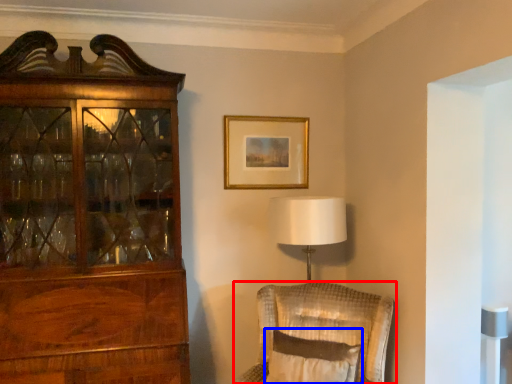
Question: Which of the following is the farthest to the observer, chair (highlighted by a red box) or pillow (highlighted by a blue box)?

Choices:
 (A) chair
 (B) pillow

Answer: (A)